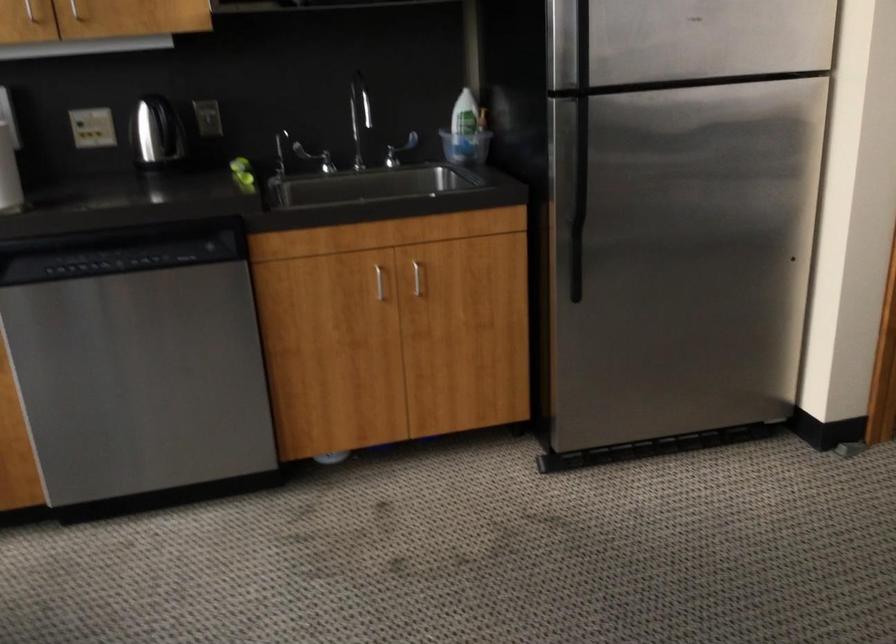
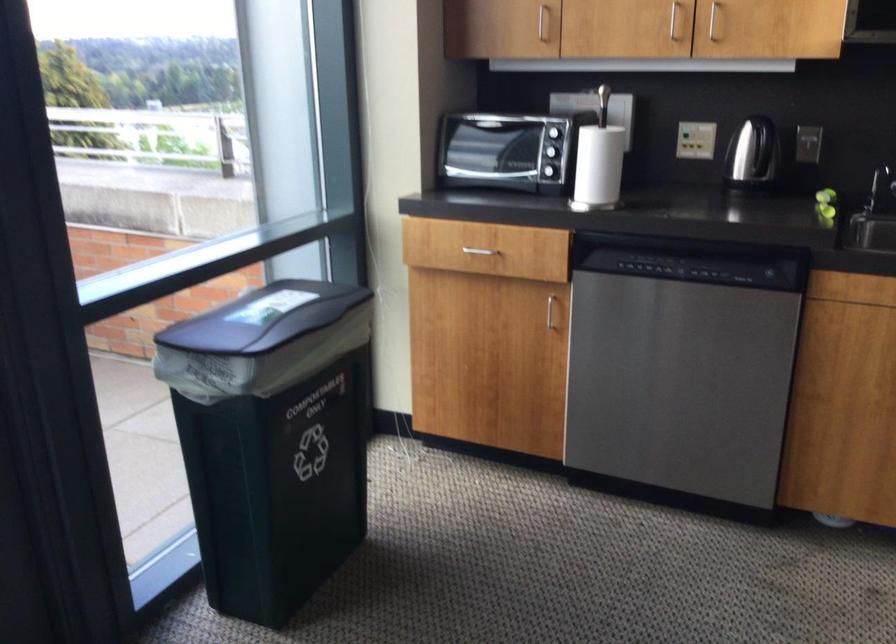
The point at (90, 129) is marked in the first image. Where is the corresponding point in the second image?

(695, 140)